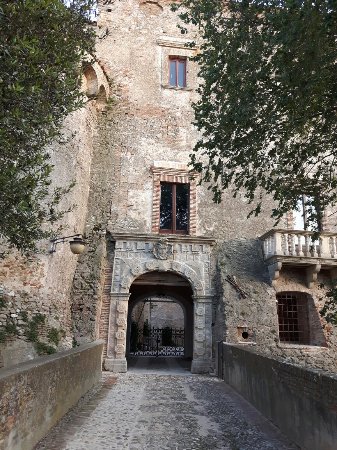
Where is `archway`? archway is located at coordinates (161, 267).